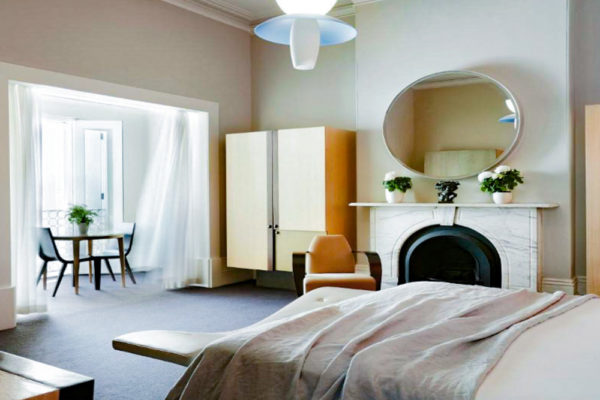
At what (x,y) coordinates should I click in order to perform the action: click on bed. Please return your answer as a coordinate pair (x, y). Image resolution: width=600 pixels, height=400 pixels. Looking at the image, I should click on (539, 357).